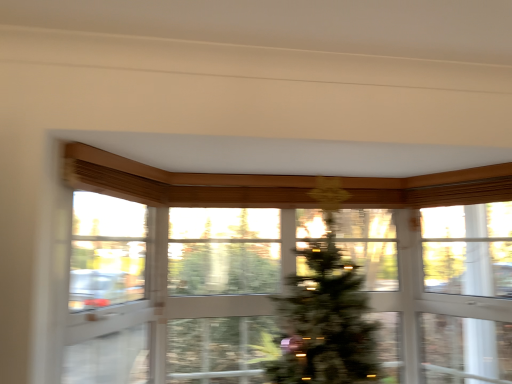
Locate an element on the screen. The height and width of the screenshot is (384, 512). free spot above green matte christmas tree at center (from a real-world perspective) is located at coordinates (282, 211).